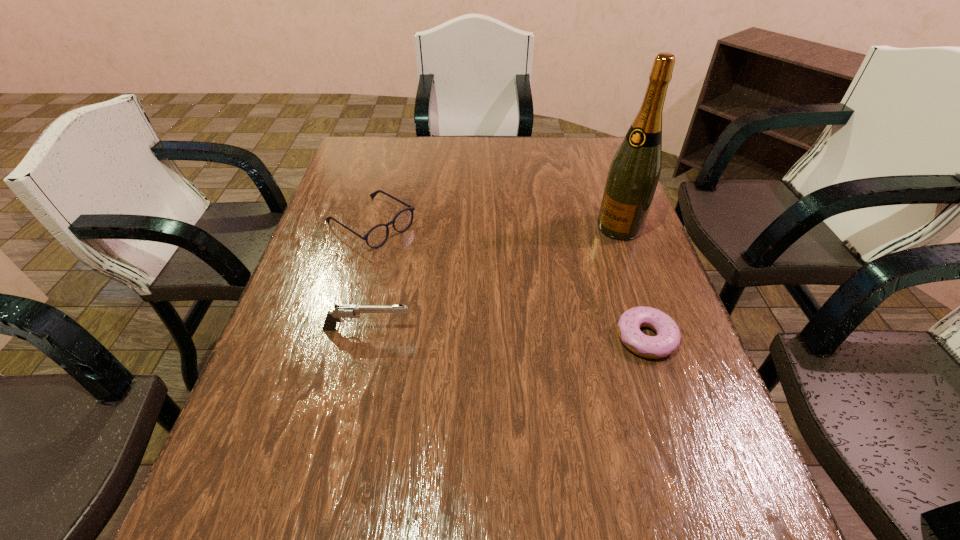
Identify the location of vacant spot on the desktop that is between the second tallest object and the doughnut and is positioned on the front-facing side of the spectacles. coord(540,334).

Where is `free spot on the desktop that is between the second tallest object and the shortest object and is positioned on the front-facing side of the tallest object`? The height and width of the screenshot is (540, 960). free spot on the desktop that is between the second tallest object and the shortest object and is positioned on the front-facing side of the tallest object is located at coordinates (493, 333).